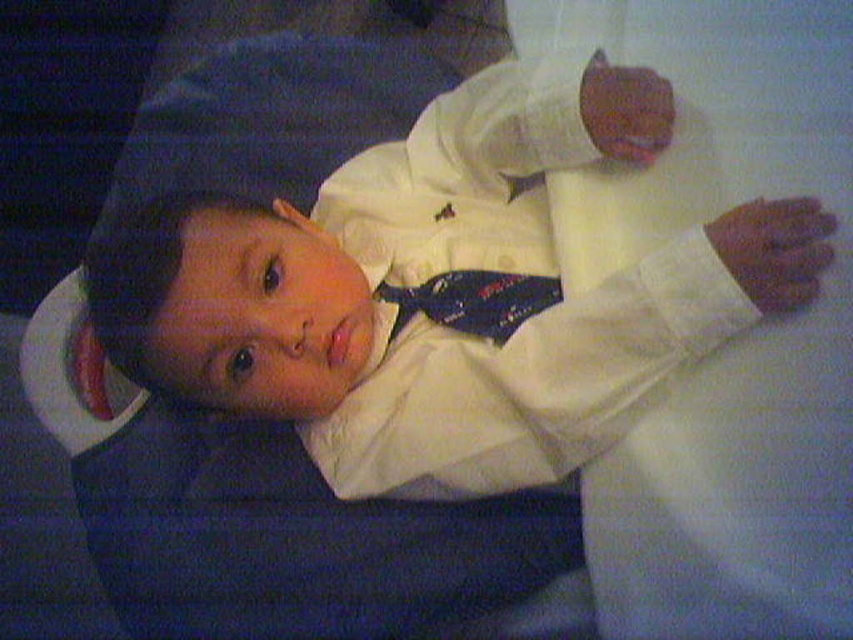
Between white satin suit at center and blue satin tie at center, which one is positioned higher?

white satin suit at center is above.

Does point (299, 364) lie in front of point (485, 284)?

Yes.

Who is more distant from viewer, (575, 403) or (509, 321)?

Positioned behind is point (509, 321).

Where is `white satin suit at center`? This screenshot has height=640, width=853. white satin suit at center is located at coordinates (437, 273).